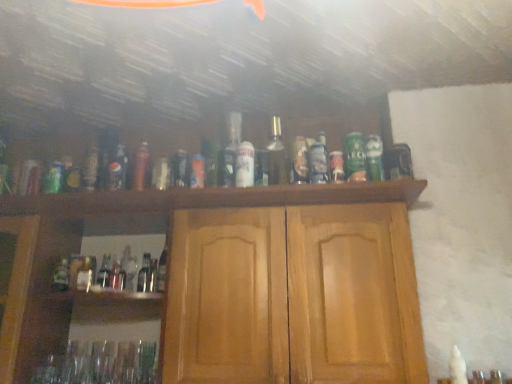
What is the approximate height of matte glass bottle at lower left, the 9th bottle when ordered from right to left?

5.06 inches.

The height and width of the screenshot is (384, 512). What do you see at coordinates (230, 150) in the screenshot?
I see `matte glass bottle at center, the 8th bottle when ordered from left to right` at bounding box center [230, 150].

What do you see at coordinates (180, 169) in the screenshot? I see `matte glass bottle at center, the fifth bottle in the right-to-left sequence` at bounding box center [180, 169].

Locate an element on the screen. matte glass bottle at center, the fifth bottle in the right-to-left sequence is located at coordinates (180, 169).

The width and height of the screenshot is (512, 384). Identify the location of matte glass bottle at lower left, which is the second bottle from left to right. (85, 276).

Based on the photo, choose the correct answer: Is matte glass bottle at lower left, the 9th bottle when ordered from right to left, inside metallic gold bottle at center, arranged as the 5th bottle when viewed from the left, or outside it?

matte glass bottle at lower left, the 9th bottle when ordered from right to left, is outside metallic gold bottle at center, arranged as the 5th bottle when viewed from the left.

Considering the sizes of objects matte glass bottle at lower left, which is the second bottle from left to right, and metallic gold bottle at center, arranged as the 5th bottle when viewed from the left, in the image provided, who is smaller, matte glass bottle at lower left, which is the second bottle from left to right, or metallic gold bottle at center, arranged as the 5th bottle when viewed from the left,?

matte glass bottle at lower left, which is the second bottle from left to right.

In the image, is matte glass bottle at lower left, which is the second bottle from left to right, on the left side or the right side of metallic gold bottle at center, placed as the 6th bottle when sorted from right to left?

Based on their positions, matte glass bottle at lower left, which is the second bottle from left to right, is located to the left of metallic gold bottle at center, placed as the 6th bottle when sorted from right to left.

Would you say metallic gold bottle at center, arranged as the 5th bottle when viewed from the left, is outside green matte can at center, the second beer positioned from the left?

metallic gold bottle at center, arranged as the 5th bottle when viewed from the left, lies outside green matte can at center, the second beer positioned from the left,'s area.

Is metallic gold bottle at center, arranged as the 5th bottle when viewed from the left, further to camera compared to green matte can at center, the first beer when ordered from right to left?

Yes.

In the scene shown: Considering the relative sizes of metallic gold bottle at center, arranged as the 5th bottle when viewed from the left, and green matte can at center, the second beer positioned from the left, in the image provided, is metallic gold bottle at center, arranged as the 5th bottle when viewed from the left, wider than green matte can at center, the second beer positioned from the left,?

Yes, metallic gold bottle at center, arranged as the 5th bottle when viewed from the left, is wider than green matte can at center, the second beer positioned from the left.

Can you see metallic gold bottle at center, arranged as the 5th bottle when viewed from the left, touching green matte can at center, the second beer positioned from the left?

metallic gold bottle at center, arranged as the 5th bottle when viewed from the left, and green matte can at center, the second beer positioned from the left, are clearly separated.

From the image's perspective, does light brown wood cabinet at center appear higher than metallic silver can at center, marked as the first bottle in a right-to-left arrangement?

No, from the image's perspective, light brown wood cabinet at center is not above metallic silver can at center, marked as the first bottle in a right-to-left arrangement.

Is light brown wood cabinet at center outside of metallic silver can at center, marked as the first bottle in a right-to-left arrangement?

light brown wood cabinet at center lies outside metallic silver can at center, marked as the first bottle in a right-to-left arrangement,'s area.

Consider the image. Can you see light brown wood cabinet at center touching metallic silver can at center, the tenth bottle positioned from the left?

No, light brown wood cabinet at center is not with metallic silver can at center, the tenth bottle positioned from the left.

Is white matte can at center, acting as the 1th beer starting from the left, surrounded by metallic gold bottle at center, placed as the 6th bottle when sorted from right to left?

No, white matte can at center, acting as the 1th beer starting from the left, is located outside of metallic gold bottle at center, placed as the 6th bottle when sorted from right to left.

Which is in front, point (149, 172) or point (238, 168)?

The point (238, 168) is closer.

Between metallic gold bottle at center, arranged as the 5th bottle when viewed from the left, and white matte can at center, which ranks as the second beer in right-to-left order, which one is positioned behind?

metallic gold bottle at center, arranged as the 5th bottle when viewed from the left, is more distant.

How different are the orientations of metallic gold bottle at center, placed as the 6th bottle when sorted from right to left, and white matte can at center, which ranks as the second beer in right-to-left order, in degrees?

The angle between the facing direction of metallic gold bottle at center, placed as the 6th bottle when sorted from right to left, and the facing direction of white matte can at center, which ranks as the second beer in right-to-left order, is 0.000239 degrees.

From the picture: Is green glass bottle at lower left, which is counted as the 10th bottle, starting from the right, oriented away from matte glass bottle at center, the sixth bottle from the left?

green glass bottle at lower left, which is counted as the 10th bottle, starting from the right, is not turned away from matte glass bottle at center, the sixth bottle from the left.

Which object is wider, green glass bottle at lower left, which is counted as the 10th bottle, starting from the right, or matte glass bottle at center, the fifth bottle in the right-to-left sequence?

Wider between the two is matte glass bottle at center, the fifth bottle in the right-to-left sequence.

From a real-world perspective, is green glass bottle at lower left, acting as the 1th bottle starting from the left, below matte glass bottle at center, the fifth bottle in the right-to-left sequence?

Indeed, from a real-world perspective, green glass bottle at lower left, acting as the 1th bottle starting from the left, is positioned beneath matte glass bottle at center, the fifth bottle in the right-to-left sequence.

From the picture: From the image's perspective, is green glass bottle at lower left, acting as the 1th bottle starting from the left, above or below matte glass bottle at center, the sixth bottle from the left?

Based on their image positions, green glass bottle at lower left, acting as the 1th bottle starting from the left, is located beneath matte glass bottle at center, the sixth bottle from the left.

From a real-world perspective, is matte glass bottle at center, which ranks as the 3th bottle in left-to-right order, on top of light brown wood cabinet at center?

Yes, from a real-world perspective, matte glass bottle at center, which ranks as the 3th bottle in left-to-right order, is above light brown wood cabinet at center.

Is matte glass bottle at center, marked as the 8th bottle in a right-to-left arrangement, spatially inside light brown wood cabinet at center, or outside of it?

The correct answer is: outside.

At what (x,y) coordinates should I click in order to perform the action: click on the 6th bottle behind the light brown wood cabinet at center, starting your count from the anchor. Please return your answer as a coordinate pair (x, y). The image size is (512, 384). Looking at the image, I should click on (117, 169).

Which of these two, translucent glass bottle at center, marked as the 7th bottle in a left-to-right arrangement, or clear glass bottle at center, the fourth bottle from the left, is smaller?

With smaller size is clear glass bottle at center, the fourth bottle from the left.

From a real-world perspective, between translucent glass bottle at center, the fourth bottle from the right, and clear glass bottle at center, the fourth bottle from the left, who is vertically higher?

From a 3D spatial view, translucent glass bottle at center, the fourth bottle from the right, is above.

Which bottle is the 7th one when counting from the back of the translucent glass bottle at center, marked as the 7th bottle in a left-to-right arrangement? Please provide its 2D coordinates.

[(145, 274)]

From the image's perspective, which bottle is the 4th one below the metallic gold bottle at center, arranged as the 5th bottle when viewed from the left? Please provide its 2D coordinates.

[(85, 276)]

From the metallic gold bottle at center, arranged as the 5th bottle when viewed from the left, count 2nd beer to the right and point to it. Please provide its 2D coordinates.

[(355, 157)]

Consider the image. Which object lies nearer to the anchor point metallic gold can at center, the 9th bottle positioned from the left, matte glass bottle at center, which ranks as the 3th bottle in left-to-right order, or matte glass bottle at center, the fifth bottle in the right-to-left sequence?

The object closer to metallic gold can at center, the 9th bottle positioned from the left, is matte glass bottle at center, the fifth bottle in the right-to-left sequence.

Which object lies nearer to the anchor point white matte can at center, acting as the 1th beer starting from the left, matte glass bottle at center, the fifth bottle in the right-to-left sequence, or matte glass bottle at center, the 8th bottle when ordered from left to right?

The object closer to white matte can at center, acting as the 1th beer starting from the left, is matte glass bottle at center, the 8th bottle when ordered from left to right.

Which object lies further to the anchor point matte glass bottle at lower left, which is the second bottle from left to right, translucent glass bottle at center, marked as the 7th bottle in a left-to-right arrangement, or matte glass bottle at center, marked as the 3th bottle in a right-to-left arrangement?

matte glass bottle at center, marked as the 3th bottle in a right-to-left arrangement, lies further to matte glass bottle at lower left, which is the second bottle from left to right, than the other object.

When comparing their distances from light brown wood cabinet at center, does green glass bottle at lower left, acting as the 1th bottle starting from the left, or metallic gold can at center, the 2th bottle positioned from the right, seem closer?

metallic gold can at center, the 2th bottle positioned from the right, is positioned closer to the anchor light brown wood cabinet at center.

From the image, which object appears to be nearer to matte glass bottle at lower left, which is the second bottle from left to right, matte glass bottle at center, the sixth bottle from the left, or metallic gold bottle at center, arranged as the 5th bottle when viewed from the left?

metallic gold bottle at center, arranged as the 5th bottle when viewed from the left.

Estimate the real-world distances between objects in this image. Which object is further from metallic silver can at center, marked as the first bottle in a right-to-left arrangement, light brown wood cabinet at center or metallic gold can at center, the 2th bottle positioned from the right?

Among the two, light brown wood cabinet at center is located further to metallic silver can at center, marked as the first bottle in a right-to-left arrangement.

Which object lies nearer to the anchor point matte glass bottle at lower left, which is the second bottle from left to right, matte glass bottle at center, the 8th bottle when ordered from left to right, or green glass bottle at lower left, acting as the 1th bottle starting from the left?

Among the two, green glass bottle at lower left, acting as the 1th bottle starting from the left, is located nearer to matte glass bottle at lower left, which is the second bottle from left to right.

Considering their positions, is clear glass bottle at center, the seventh bottle positioned from the right, positioned further to matte glass bottle at lower left, the 9th bottle when ordered from right to left, than white matte can at center, which ranks as the second beer in right-to-left order?

Based on the image, white matte can at center, which ranks as the second beer in right-to-left order, appears to be further to matte glass bottle at lower left, the 9th bottle when ordered from right to left.

At what (x,y) coordinates should I click in order to perform the action: click on beer between green glass bottle at lower left, acting as the 1th bottle starting from the left, and metallic gold can at center, the 2th bottle positioned from the right, from left to right. Please return your answer as a coordinate pair (x, y). Looking at the image, I should click on (245, 165).

This screenshot has width=512, height=384. Identify the location of beer between metallic gold bottle at center, placed as the 6th bottle when sorted from right to left, and metallic silver can at center, the tenth bottle positioned from the left. tap(245, 165).

At what (x,y) coordinates should I click in order to perform the action: click on bottle between translucent glass bottle at center, marked as the 7th bottle in a left-to-right arrangement, and white matte can at center, acting as the 1th beer starting from the left, from left to right. Please return your answer as a coordinate pair (x, y). This screenshot has height=384, width=512. Looking at the image, I should click on (230, 150).

Find the location of a particular element. This screenshot has height=384, width=512. cabinetry between green glass bottle at lower left, acting as the 1th bottle starting from the left, and white matte can at center, acting as the 1th beer starting from the left, in the horizontal direction is located at coordinates (272, 279).